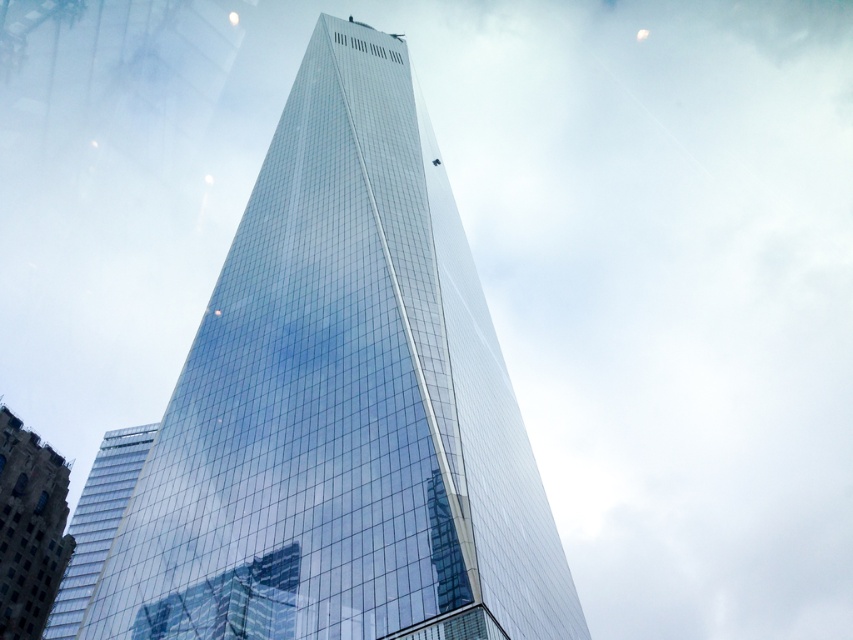
Does transparent glass tower at center come in front of glassy reflective building at lower left?

Yes, it is.

Who is more forward, [229,424] or [36,509]?

Point [229,424] is more forward.

Is point (509, 449) farther from viewer compared to point (32, 512)?

No, (509, 449) is closer to viewer.

Where is `transparent glass tower at center`? The width and height of the screenshot is (853, 640). transparent glass tower at center is located at coordinates (341, 406).